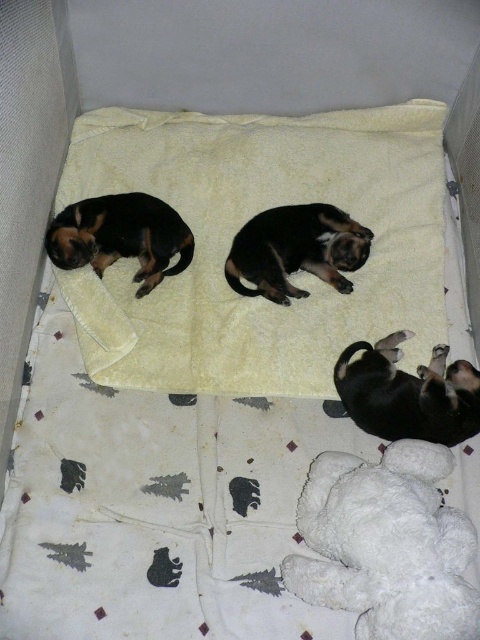
Question: Which point appears closest to the camera in this image?

Choices:
 (A) (279, 260)
 (B) (196, 180)
 (C) (422, 483)
 (D) (395, 388)

Answer: (C)

Question: Can you confirm if black fur dog at lower right is positioned above black fur dog at center?

Choices:
 (A) yes
 (B) no

Answer: (B)

Question: Which point is closer to the camera?

Choices:
 (A) yellow soft blanket at upper center
 (B) white plush teddy bear at lower right
 (C) black and tan fur at upper left
 (D) black fur dog at center

Answer: (B)

Question: Based on their relative distances, which object is nearer to the white plush teddy bear at lower right?

Choices:
 (A) black and tan fur at upper left
 (B) yellow soft blanket at upper center
 (C) black fur dog at lower right
 (D) black fur dog at center

Answer: (C)

Question: Can you confirm if yellow soft blanket at upper center is bigger than white plush teddy bear at lower right?

Choices:
 (A) yes
 (B) no

Answer: (A)

Question: Is white plush teddy bear at lower right to the left of black fur dog at center from the viewer's perspective?

Choices:
 (A) no
 (B) yes

Answer: (A)